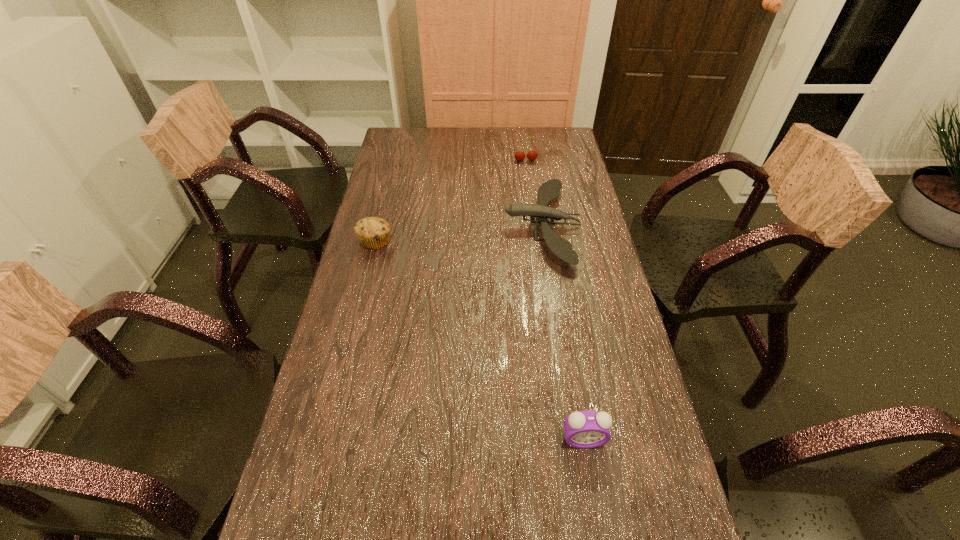
The width and height of the screenshot is (960, 540). I want to click on vacant space that's between the leftmost object and the alarm clock, so click(479, 340).

Locate an element on the screen. The image size is (960, 540). vacant space that's between the nearest object and the muffin is located at coordinates (479, 340).

This screenshot has width=960, height=540. What are the coordinates of `free spot between the drone and the nearest object` in the screenshot? It's located at (563, 333).

Where is `vacant space that is in between the nearest object and the drone`? vacant space that is in between the nearest object and the drone is located at coordinates (563, 333).

Find the location of a particular element. This screenshot has width=960, height=540. vacant area that lies between the drone and the leftmost object is located at coordinates (459, 233).

The height and width of the screenshot is (540, 960). I want to click on free space that is in between the cherry and the leftmost object, so click(450, 201).

At what (x,y) coordinates should I click in order to perform the action: click on free space between the farthest object and the drone. Please return your answer as a coordinate pair (x, y). Image resolution: width=960 pixels, height=540 pixels. Looking at the image, I should click on (534, 193).

Choose which object is the second nearest neighbor to the alarm clock. Please provide its 2D coordinates. Your answer should be formatted as a tuple, i.e. [(x, y)], where the tuple contains the x and y coordinates of a point satisfying the conditions above.

[(373, 233)]

Select which object is the second closest to the muffin. Please provide its 2D coordinates. Your answer should be formatted as a tuple, i.e. [(x, y)], where the tuple contains the x and y coordinates of a point satisfying the conditions above.

[(531, 155)]

Where is `vacant space that satisfies the following two spatial constraints: 1. at the head of the drone; 2. on the front side of the leftmost object`? vacant space that satisfies the following two spatial constraints: 1. at the head of the drone; 2. on the front side of the leftmost object is located at coordinates (545, 241).